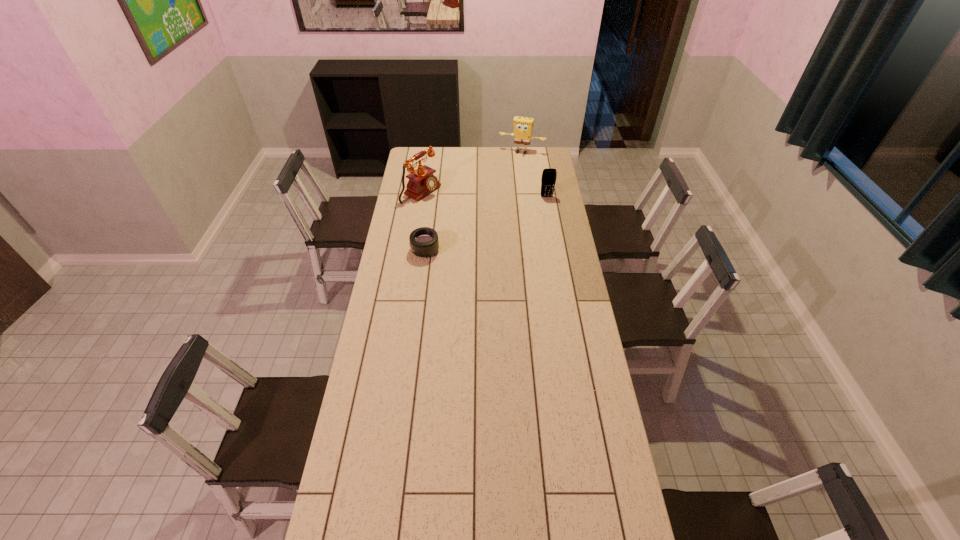
This screenshot has height=540, width=960. I want to click on free space located 0.250m on the dial of the telephone, so click(470, 218).

You are a GUI agent. You are given a task and a screenshot of the screen. Output one action in this format:
    pyautogui.click(x=<x>, y=<y>)
    Task: Click on the vacant region located on the dial of the telephone
    Image resolution: width=960 pixels, height=540 pixels.
    Given the screenshot: What is the action you would take?
    tap(489, 227)

I want to click on vacant space located on the dial of the telephone, so click(x=482, y=224).

This screenshot has width=960, height=540. In order to click on object that is positioned at the far edge in this screenshot , I will do `click(523, 126)`.

You are a GUI agent. You are given a task and a screenshot of the screen. Output one action in this format:
    pyautogui.click(x=<x>, y=<y>)
    Task: Click on the telephoto lens present at the left edge
    This screenshot has height=540, width=960.
    Given the screenshot: What is the action you would take?
    pyautogui.click(x=424, y=242)

Find the location of `telephone that is at the left edge`. telephone that is at the left edge is located at coordinates (421, 182).

In order to click on cellular telephone present at the right edge in this screenshot , I will do tap(548, 180).

This screenshot has width=960, height=540. Identify the location of sponge located at the right edge. (523, 126).

What are the coordinates of `object that is at the far right corner` in the screenshot? It's located at (523, 126).

The image size is (960, 540). In the image, there is a desktop. Identify the location of vacant space at the far edge. (518, 164).